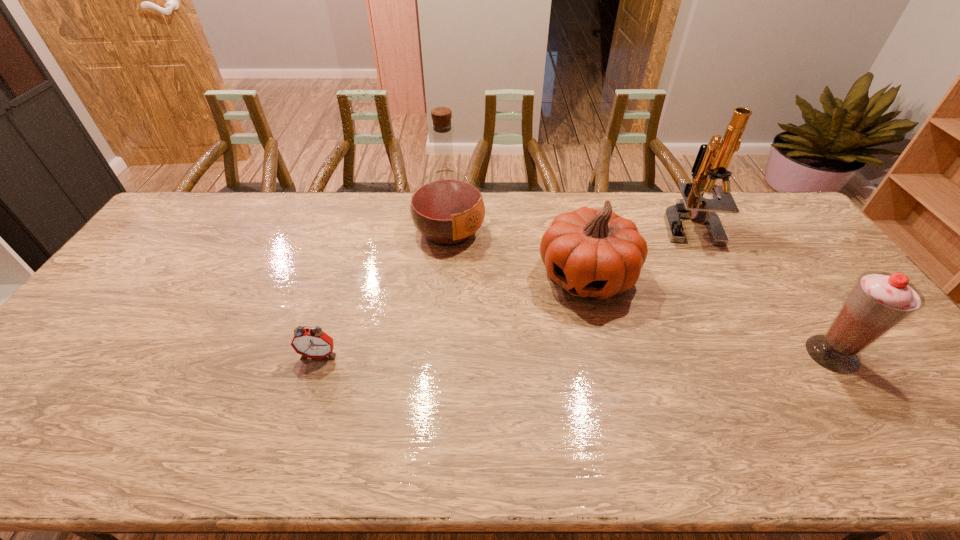
Where is `free space located on the front label of the fourth object from right to left`? Image resolution: width=960 pixels, height=540 pixels. free space located on the front label of the fourth object from right to left is located at coordinates click(569, 305).

The image size is (960, 540). In order to click on free space located on the front label of the fourth object from right to left in this screenshot , I will do `click(533, 283)`.

Image resolution: width=960 pixels, height=540 pixels. Identify the location of blank space located on the front label of the fourth object from right to left. (489, 255).

At what (x,y) coordinates should I click in order to perform the action: click on vacant space located 0.240m at the eyepiece of the microscope. Please return your answer as a coordinate pair (x, y). The width and height of the screenshot is (960, 540). Looking at the image, I should click on (665, 288).

The image size is (960, 540). What are the coordinates of `vacant point located at the eyepiece of the microscope` in the screenshot? It's located at (655, 315).

Find the location of a particular element. free space located 0.100m at the eyepiece of the microscope is located at coordinates [x=677, y=261].

Where is `vacant region located on the face of the second shortest object`? This screenshot has width=960, height=540. vacant region located on the face of the second shortest object is located at coordinates tap(532, 383).

At what (x,y) coordinates should I click in order to perform the action: click on vacant space located 0.140m on the face of the second shortest object. Please return your answer as a coordinate pair (x, y). The image size is (960, 540). Looking at the image, I should click on (552, 345).

This screenshot has width=960, height=540. What are the coordinates of `vacant space located on the face of the second shortest object` in the screenshot? It's located at (541, 364).

You are a GUI agent. You are given a task and a screenshot of the screen. Output one action in this format:
    pyautogui.click(x=<x>, y=<y>)
    Task: Click on the liquor located at the far edge
    The height and width of the screenshot is (540, 960).
    Given the screenshot: What is the action you would take?
    pyautogui.click(x=447, y=208)